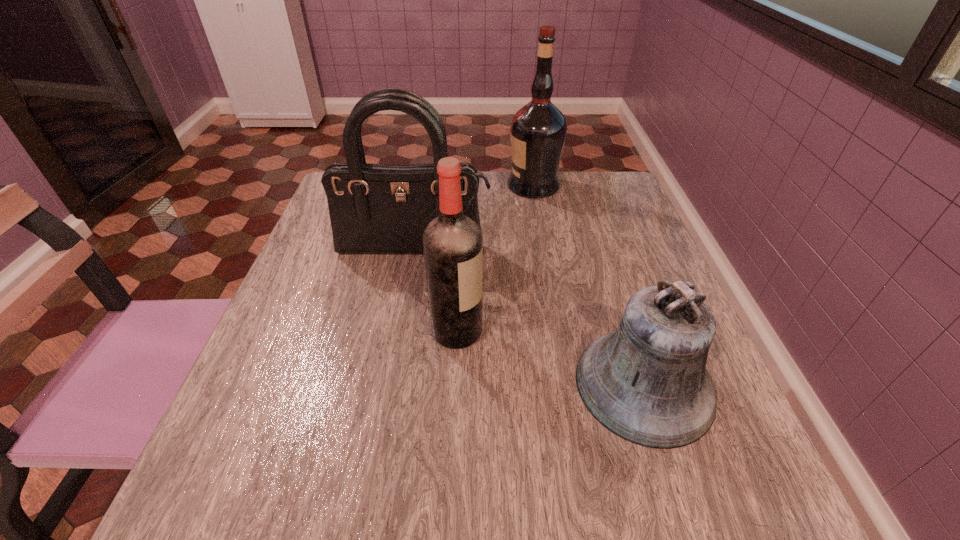
The width and height of the screenshot is (960, 540). In order to click on vacant space located on the left of the shortest object in this screenshot , I will do `click(444, 384)`.

Locate an element on the screen. object that is at the far edge is located at coordinates (538, 130).

This screenshot has height=540, width=960. Find the location of `object located in the left edge section of the desktop`. object located in the left edge section of the desktop is located at coordinates (374, 208).

Locate an element on the screen. object located in the right edge section of the desktop is located at coordinates (647, 382).

This screenshot has height=540, width=960. Identify the location of vacant space at the far edge of the desktop. (563, 188).

What are the coordinates of `vacant space at the near edge of the desktop` in the screenshot? It's located at (559, 467).

In the image, there is a desktop. Where is `vacant space at the left edge`? vacant space at the left edge is located at coordinates (350, 280).

Locate an element on the screen. Image resolution: width=960 pixels, height=540 pixels. vacant space at the right edge is located at coordinates (592, 271).

You are a GUI agent. You are given a task and a screenshot of the screen. Output one action in this format:
    pyautogui.click(x=<x>, y=<y>)
    Task: Click on the free space at the near right corner
    This screenshot has width=960, height=540.
    Given the screenshot: What is the action you would take?
    pyautogui.click(x=759, y=501)

In order to click on free space between the second farthest object and the shortest object in this screenshot , I will do `click(529, 318)`.